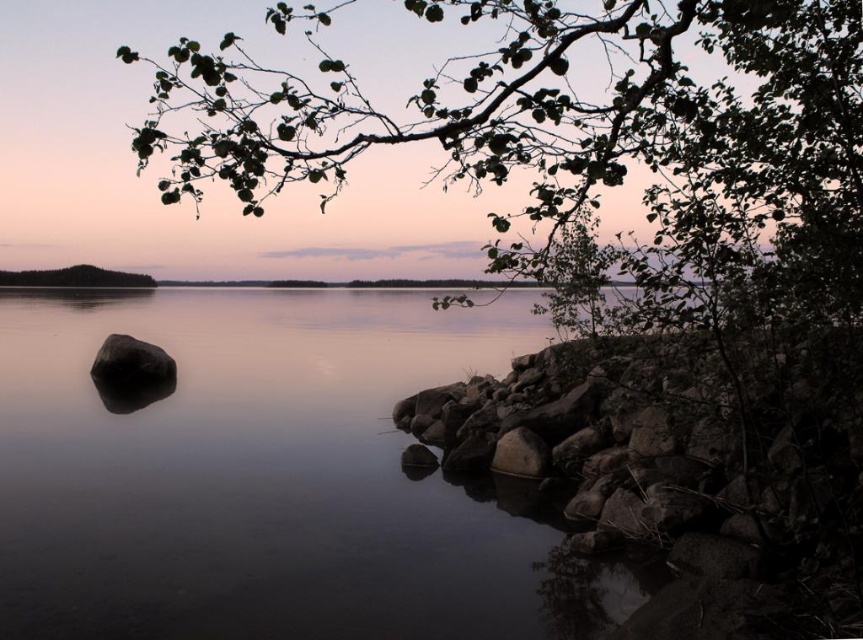
You are a photographer planning to capture the entire scene in one shot. Given that the smooth water at center and the green leafy tree at left are both in your frame, which object would occupy more of the visual space?

The smooth water at center occupies more visual space than the green leafy tree at left because it is described as bigger in size.

You are standing at the lakeside and want to locate the green leafy branch at upper center. According to the coordinates provided, where exactly is it positioned?

The green leafy branch at upper center is located at point (561, 122).

You are standing at the lakeside and see the point marked as point (561, 122). What object does this point correspond to?

The point (561, 122) corresponds to the green leafy branch at upper center.